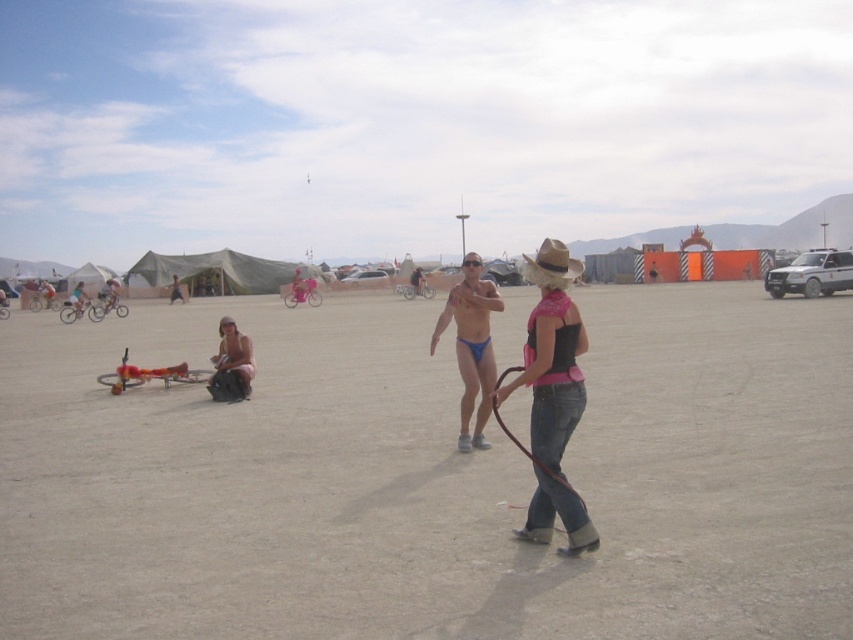
Does pink bandana at center come behind black leather leash at center?

Yes, pink bandana at center is behind black leather leash at center.

Which is in front, point (573, 410) or point (496, 380)?

Point (573, 410)

Is point (576, 403) less distant than point (521, 365)?

Yes, it is.

This screenshot has height=640, width=853. I want to click on pink bandana at center, so click(552, 396).

Between pink bandana at center and matte pink bikini at center, which one has less height?

With less height is matte pink bikini at center.

Does pink bandana at center appear over matte pink bikini at center?

Correct, pink bandana at center is located above matte pink bikini at center.

In order to click on pink bandana at center in this screenshot , I will do `click(552, 396)`.

Locate an element on the screen. Image resolution: width=853 pixels, height=640 pixels. pink bandana at center is located at coordinates (552, 396).

Does brown straw cowboy hat at center have a greater width compared to black leather leash at center?

Indeed, brown straw cowboy hat at center has a greater width compared to black leather leash at center.

Who is higher up, brown straw cowboy hat at center or black leather leash at center?

brown straw cowboy hat at center is above.

At what (x,y) coordinates should I click in order to perform the action: click on brown straw cowboy hat at center. Please return your answer as a coordinate pair (x, y). The width and height of the screenshot is (853, 640). Looking at the image, I should click on (550, 264).

The image size is (853, 640). In order to click on brown straw cowboy hat at center in this screenshot , I will do `click(550, 264)`.